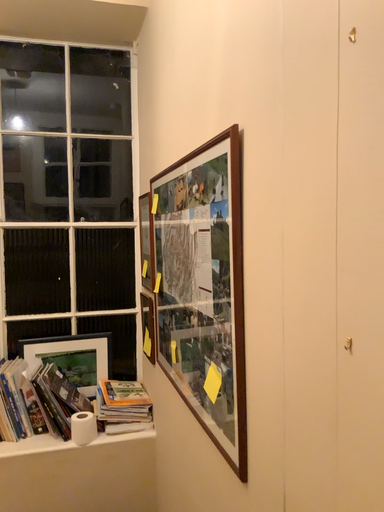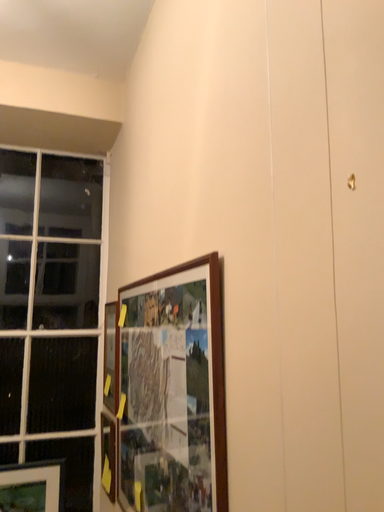
Question: How did the camera likely rotate when shooting the video?

Choices:
 (A) rotated upward
 (B) rotated downward

Answer: (A)